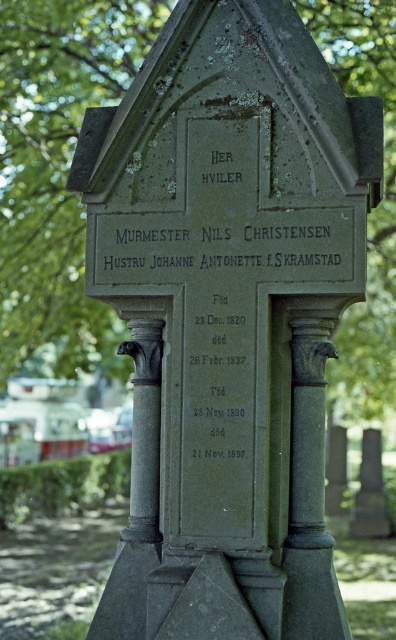
Is green lichen-covered stone at upper center in front of black stone text at center?

No, green lichen-covered stone at upper center is behind black stone text at center.

Is green lichen-covered stone at upper center shorter than black stone text at center?

No, green lichen-covered stone at upper center is not shorter than black stone text at center.

Between point (55, 224) and point (217, 381), which one is positioned behind?

The point (55, 224) is more distant.

Locate an element on the screen. green lichen-covered stone at upper center is located at coordinates (57, 173).